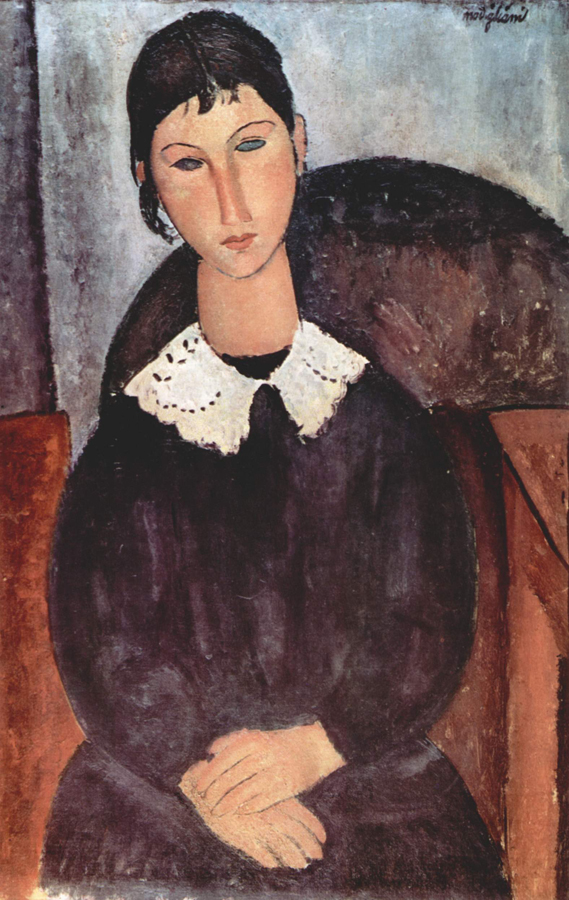
This screenshot has width=569, height=900. Identify the location of walls. (16, 64), (101, 256).